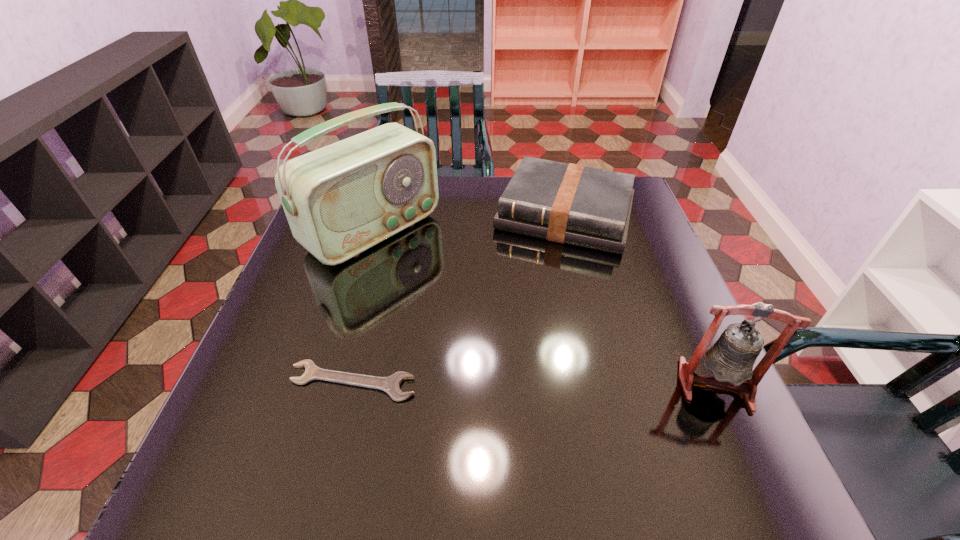
Locate an element on the screen. The height and width of the screenshot is (540, 960). wrench is located at coordinates (391, 385).

At what (x,y) coordinates should I click in order to perform the action: click on bell. Please return your answer as a coordinate pair (x, y). This screenshot has height=540, width=960. Looking at the image, I should click on (731, 358).

Identify the location of radio receiver. Image resolution: width=960 pixels, height=540 pixels. (342, 199).

I want to click on the second shortest object, so click(x=568, y=203).

You are a GUI agent. You are given a task and a screenshot of the screen. Output one action in this format:
    pyautogui.click(x=<x>, y=<y>)
    Task: Click on the vacant space situated on the back of the shortest object
    The width and height of the screenshot is (960, 540).
    Given the screenshot: What is the action you would take?
    pyautogui.click(x=367, y=326)

Locate an element on the screen. This screenshot has width=960, height=540. free space located on the left of the second tallest object is located at coordinates (498, 385).

I want to click on vacant space located 0.390m on the front panel of the tallest object, so click(x=528, y=342).

You are a GUI agent. You are given a task and a screenshot of the screen. Output one action in this format:
    pyautogui.click(x=<x>, y=<y>)
    Task: Click on the vacant area situated 0.350m on the front panel of the tallest object
    
    Given the screenshot: What is the action you would take?
    pyautogui.click(x=515, y=333)

Identify the location of vacant space located on the front panel of the tallest object. (489, 314).

Locate an element on the screen. This screenshot has width=960, height=540. free region located on the spine side of the third tallest object is located at coordinates tap(541, 274).